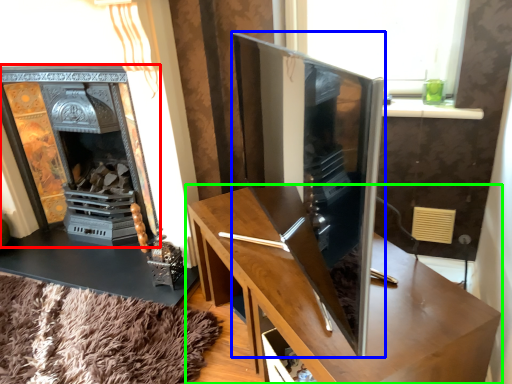
Question: Which object is positioned farthest from fireplace (highlighted by a red box)? Select from tv cabinet (highlighted by a blue box) and table (highlighted by a green box).

Choices:
 (A) tv cabinet
 (B) table

Answer: (A)